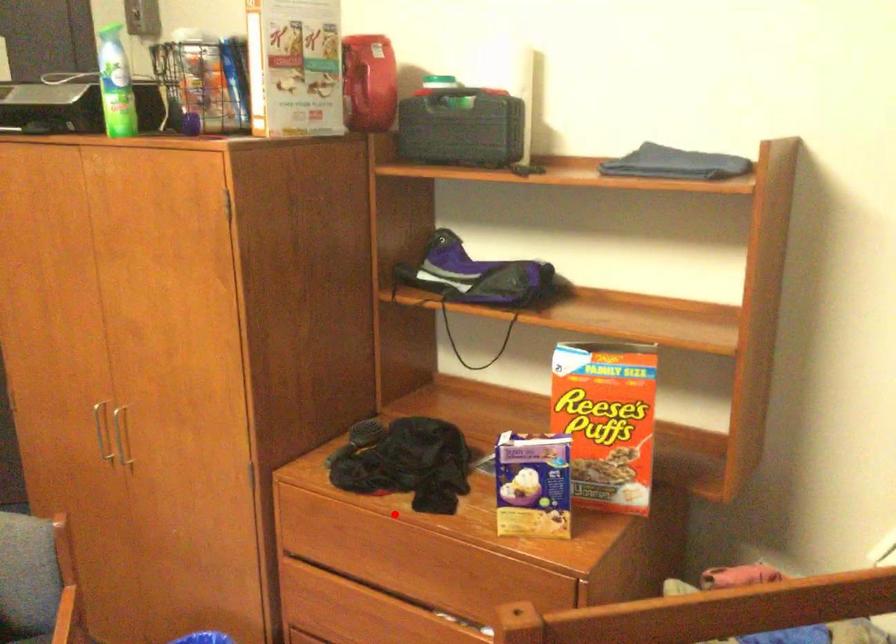
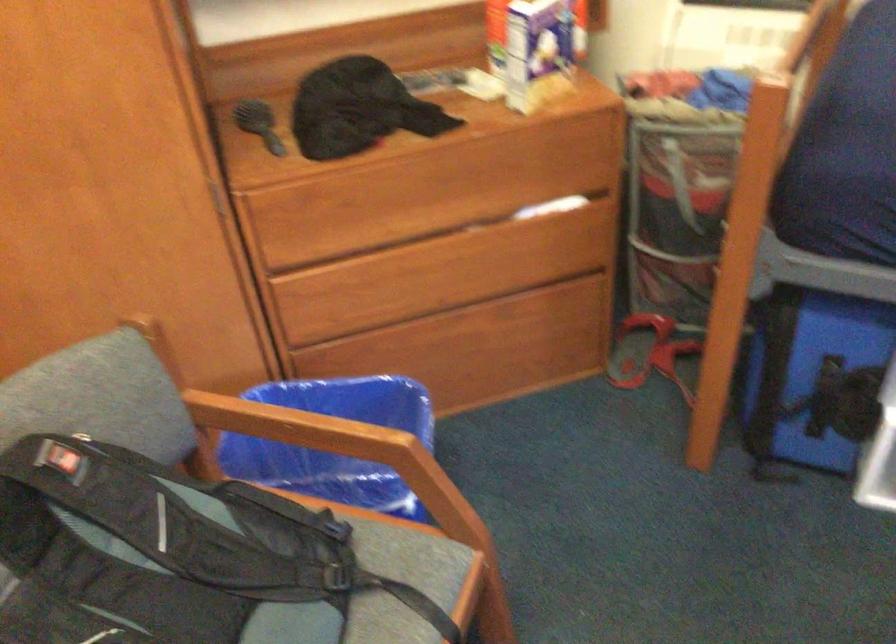
The point at the highlighted location is marked in the first image. Where is the corresponding point in the second image?

(401, 151)